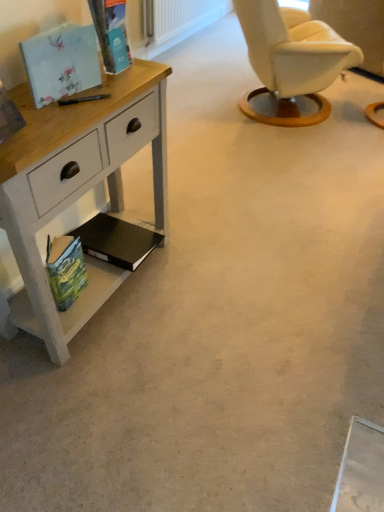
Question: Is black matte book at lower left, the 2th magazine from the bottom, closer to camera compared to matte floral-patterned book at upper left, which appears as the 3th magazine when ordered from the bottom?

Choices:
 (A) yes
 (B) no

Answer: (B)

Question: Is matte floral-patterned book at upper left, which appears as the 3th magazine when ordered from the bottom, inside black matte book at lower left, arranged as the third magazine when viewed from the top?

Choices:
 (A) no
 (B) yes

Answer: (A)

Question: Does black matte book at lower left, the 2th magazine from the bottom, have a lesser width compared to matte floral-patterned book at upper left, which appears as the 3th magazine when ordered from the bottom?

Choices:
 (A) no
 (B) yes

Answer: (A)

Question: From the image's perspective, is black matte book at lower left, the 2th magazine from the bottom, on top of matte floral-patterned book at upper left, which appears as the 3th magazine when ordered from the bottom?

Choices:
 (A) yes
 (B) no

Answer: (B)

Question: Is black matte book at lower left, the 2th magazine from the bottom, far from matte floral-patterned book at upper left, the 2th magazine from the top?

Choices:
 (A) yes
 (B) no

Answer: (B)

Question: Is white painted wood desk at left bigger or smaller than matte cardboard magazine at upper left, which is the fourth magazine in bottom-to-top order?

Choices:
 (A) big
 (B) small

Answer: (A)

Question: From the image's perspective, relative to matte cardboard magazine at upper left, which is the fourth magazine in bottom-to-top order, is white painted wood desk at left above or below?

Choices:
 (A) below
 (B) above

Answer: (A)

Question: Is point (87, 118) positioned closer to the camera than point (92, 6)?

Choices:
 (A) closer
 (B) farther

Answer: (A)

Question: From a real-world perspective, is white painted wood desk at left positioned above or below matte cardboard magazine at upper left, which is the 1th magazine from top to bottom?

Choices:
 (A) above
 (B) below

Answer: (B)

Question: Considering the relative positions of white painted wood desk at left and green matte book at lower left, acting as the 4th magazine starting from the top, in the image provided, is white painted wood desk at left to the left or to the right of green matte book at lower left, acting as the 4th magazine starting from the top,?

Choices:
 (A) left
 (B) right

Answer: (B)

Question: Considering the positions of point (165, 138) and point (86, 274), is point (165, 138) closer or farther from the camera than point (86, 274)?

Choices:
 (A) farther
 (B) closer

Answer: (A)

Question: From their relative heights in the image, would you say white painted wood desk at left is taller or shorter than green matte book at lower left, acting as the 4th magazine starting from the top?

Choices:
 (A) short
 (B) tall

Answer: (B)

Question: From the image's perspective, is white painted wood desk at left above or below green matte book at lower left, the first magazine from the bottom?

Choices:
 (A) above
 (B) below

Answer: (A)

Question: In terms of size, does matte floral-patterned book at upper left, the 2th magazine from the top, appear bigger or smaller than black matte book at lower left, the 2th magazine from the bottom?

Choices:
 (A) big
 (B) small

Answer: (B)

Question: Would you say matte floral-patterned book at upper left, the 2th magazine from the top, is inside or outside black matte book at lower left, the 2th magazine from the bottom?

Choices:
 (A) inside
 (B) outside

Answer: (B)